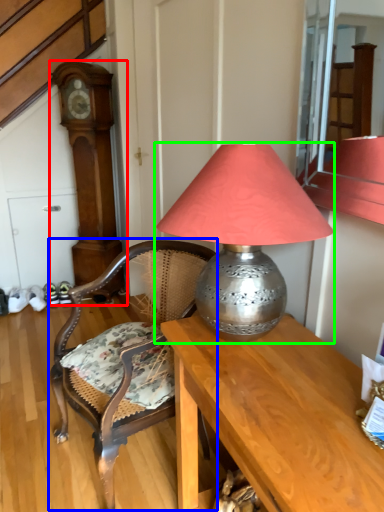
Question: Based on their relative distances, which object is nearer to clock (highlighted by a red box)? Choose from chair (highlighted by a blue box) and lamp (highlighted by a green box).

Choices:
 (A) chair
 (B) lamp

Answer: (A)